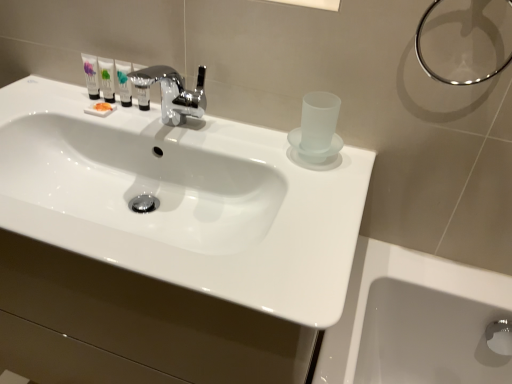
Question: Is satin silver bottle at center, the first mouthwash when ordered from right to left, not close to metallic ring at upper right?

Choices:
 (A) yes
 (B) no

Answer: (B)

Question: Considering the relative positions of satin silver bottle at center, which ranks as the 4th mouthwash in left-to-right order, and metallic ring at upper right in the image provided, is satin silver bottle at center, which ranks as the 4th mouthwash in left-to-right order, to the right of metallic ring at upper right from the viewer's perspective?

Choices:
 (A) yes
 (B) no

Answer: (B)

Question: Does satin silver bottle at center, which ranks as the 4th mouthwash in left-to-right order, appear on the left side of metallic ring at upper right?

Choices:
 (A) no
 (B) yes

Answer: (B)

Question: Does satin silver bottle at center, the first mouthwash when ordered from right to left, contain metallic ring at upper right?

Choices:
 (A) no
 (B) yes

Answer: (A)

Question: Does satin silver bottle at center, which ranks as the 4th mouthwash in left-to-right order, have a greater width compared to metallic ring at upper right?

Choices:
 (A) yes
 (B) no

Answer: (B)

Question: Is satin silver bottle at center, the first mouthwash when ordered from right to left, in front of metallic ring at upper right?

Choices:
 (A) yes
 (B) no

Answer: (B)

Question: Is satin silver bottle at center, which ranks as the 4th mouthwash in left-to-right order, at the back of matte white tube at upper left, which ranks as the 3th mouthwash in right-to-left order?

Choices:
 (A) yes
 (B) no

Answer: (B)

Question: From a real-world perspective, is matte white tube at upper left, which ranks as the 3th mouthwash in right-to-left order, physically above satin silver bottle at center, which ranks as the 4th mouthwash in left-to-right order?

Choices:
 (A) no
 (B) yes

Answer: (A)

Question: Is matte white tube at upper left, the 2th mouthwash from the left, not inside satin silver bottle at center, the first mouthwash when ordered from right to left?

Choices:
 (A) no
 (B) yes

Answer: (B)

Question: Is matte white tube at upper left, which ranks as the 3th mouthwash in right-to-left order, touching satin silver bottle at center, which ranks as the 4th mouthwash in left-to-right order?

Choices:
 (A) yes
 (B) no

Answer: (A)

Question: From the image's perspective, would you say matte white tube at upper left, the 2th mouthwash from the left, is positioned over satin silver bottle at center, which ranks as the 4th mouthwash in left-to-right order?

Choices:
 (A) yes
 (B) no

Answer: (A)

Question: From a real-world perspective, is matte white tube at upper left, which ranks as the 3th mouthwash in right-to-left order, under satin silver bottle at center, which ranks as the 4th mouthwash in left-to-right order?

Choices:
 (A) yes
 (B) no

Answer: (A)

Question: Considering the relative positions of matte white tube at upper left, the 1th mouthwash positioned from the left, and white glossy sink at center in the image provided, is matte white tube at upper left, the 1th mouthwash positioned from the left, to the right of white glossy sink at center from the viewer's perspective?

Choices:
 (A) no
 (B) yes

Answer: (A)